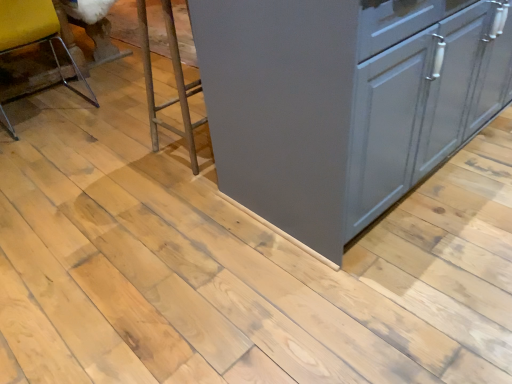
At what (x,y) coordinates should I click in order to perform the action: click on vacant space that's between metallic silver step stool at center and clear plastic chair at left. Please return your answer as a coordinate pair (x, y). This screenshot has width=512, height=384. Looking at the image, I should click on (102, 132).